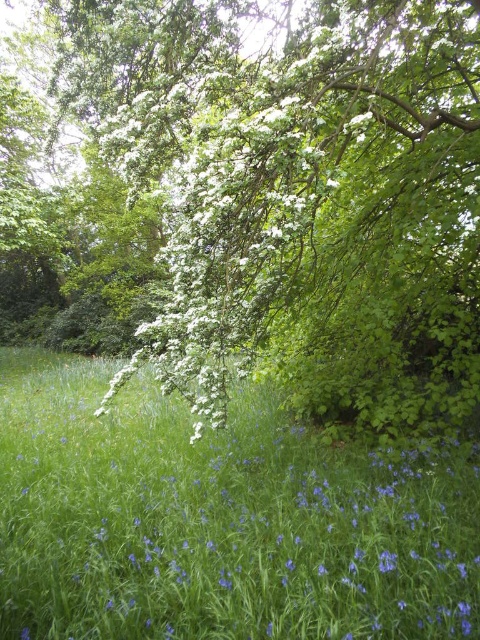
Which is more to the right, green leafy tree at upper center or white matte flower at center?

white matte flower at center is more to the right.

Can you confirm if green leafy tree at upper center is bigger than white matte flower at center?

Correct, green leafy tree at upper center is larger in size than white matte flower at center.

This screenshot has height=640, width=480. I want to click on green leafy tree at upper center, so click(279, 196).